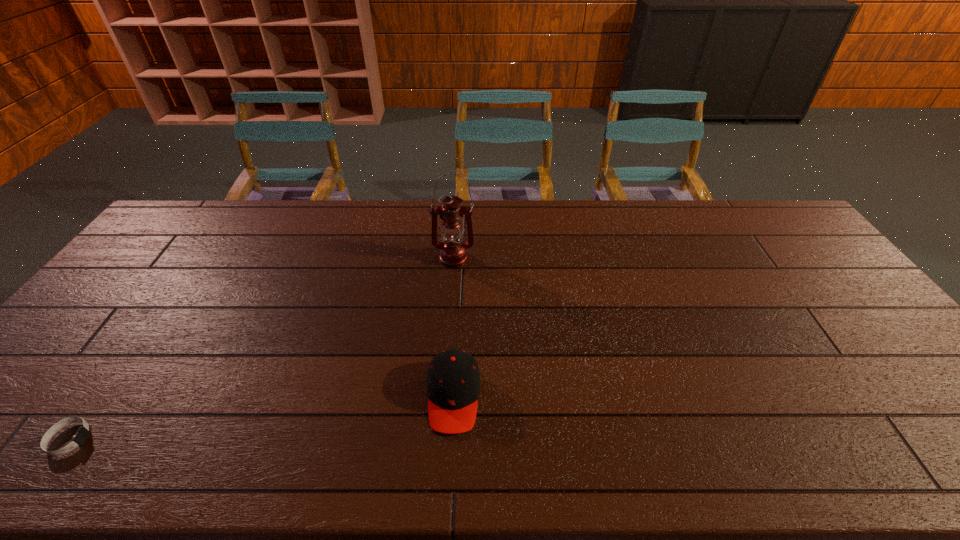
What are the coordinates of `free area in between the oil lamp and the cap` in the screenshot? It's located at (453, 327).

This screenshot has width=960, height=540. In order to click on free space that is in between the wristband and the second shortest object in this screenshot , I will do `click(261, 418)`.

The width and height of the screenshot is (960, 540). I want to click on free space between the wristband and the tallest object, so click(x=261, y=349).

Where is `vacant region between the shortest object and the tallest object`? This screenshot has height=540, width=960. vacant region between the shortest object and the tallest object is located at coordinates (261, 349).

Find the location of a particular element. free spot between the wristband and the farthest object is located at coordinates (261, 349).

What are the coordinates of `free spot between the tallest object and the second tallest object` in the screenshot? It's located at (453, 327).

Find the location of a particular element. The image size is (960, 540). free space between the second shortest object and the leftmost object is located at coordinates (261, 418).

Locate which object ranks second in proximity to the second shortest object. Please provide its 2D coordinates. Your answer should be formatted as a tuple, i.e. [(x, y)], where the tuple contains the x and y coordinates of a point satisfying the conditions above.

[(82, 434)]

Locate an element on the screen. The image size is (960, 540). the second closest object to the wristband is located at coordinates (453, 252).

Locate an element on the screen. vacant area that satisfies the following two spatial constraints: 1. on the front-facing side of the second shortest object; 2. on the outer surface of the shortest object is located at coordinates (451, 439).